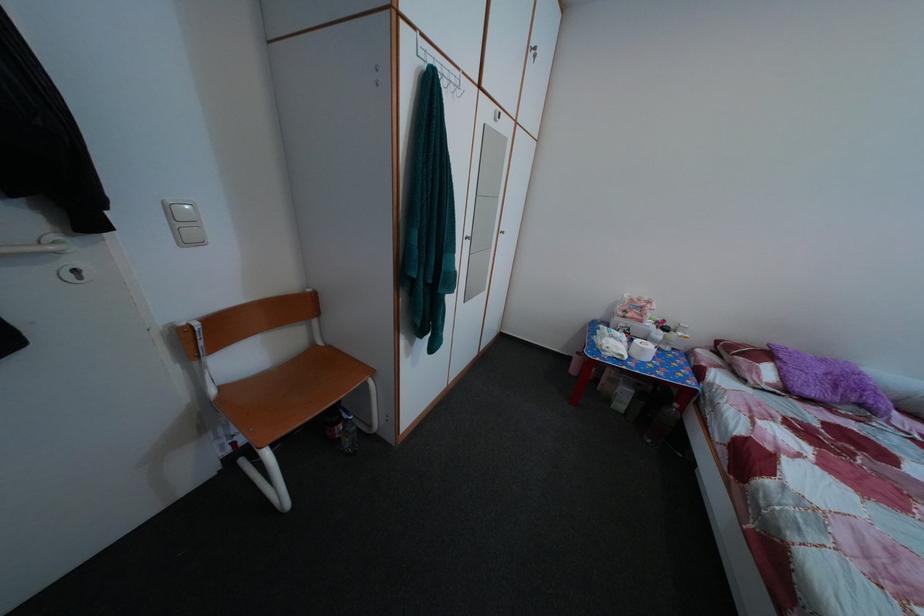
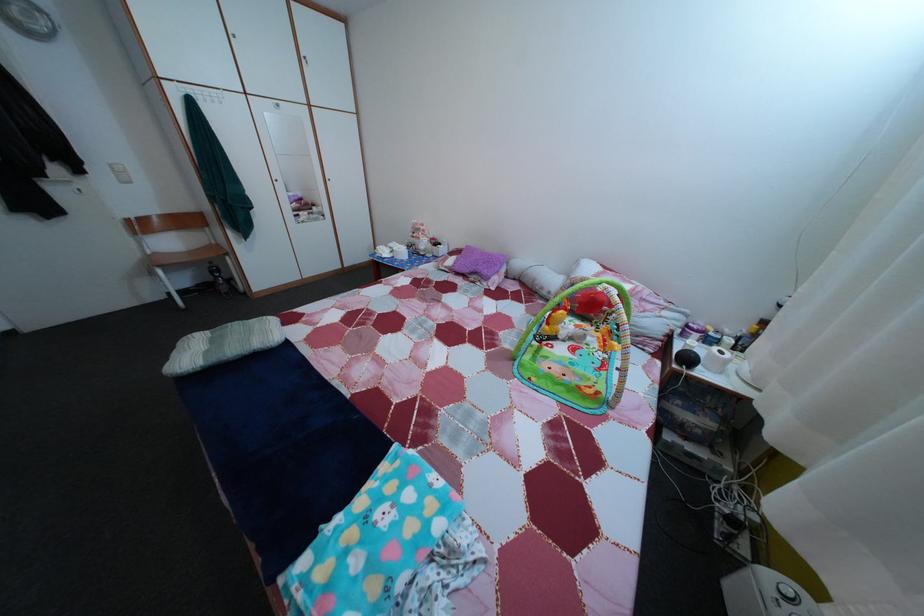
In the second image, find the point that corresponds to point (832, 369) in the first image.

(492, 261)